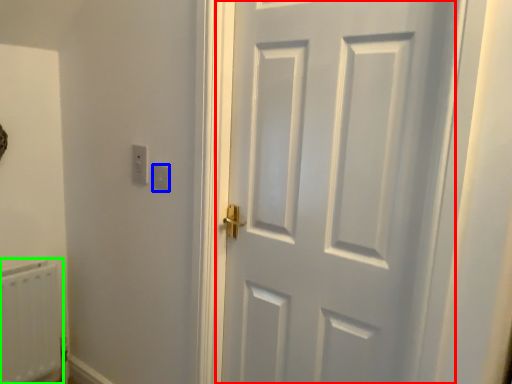
Question: Which is farther away from door (highlighted by a red box)? light switch (highlighted by a blue box) or radiator (highlighted by a green box)?

Choices:
 (A) light switch
 (B) radiator

Answer: (B)